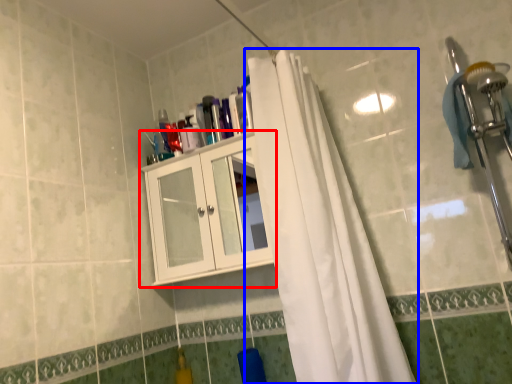
Question: Which object appears closest to the camera in this image, cabinetry (highlighted by a red box) or curtain (highlighted by a blue box)?

Choices:
 (A) cabinetry
 (B) curtain

Answer: (B)